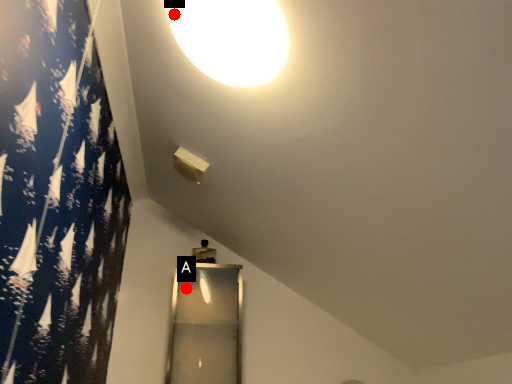
Question: Two points are circled on the image, labeled by A and B beside each circle. Which of the following is the farthest from the observer?

Choices:
 (A) A is further
 (B) B is further

Answer: (A)